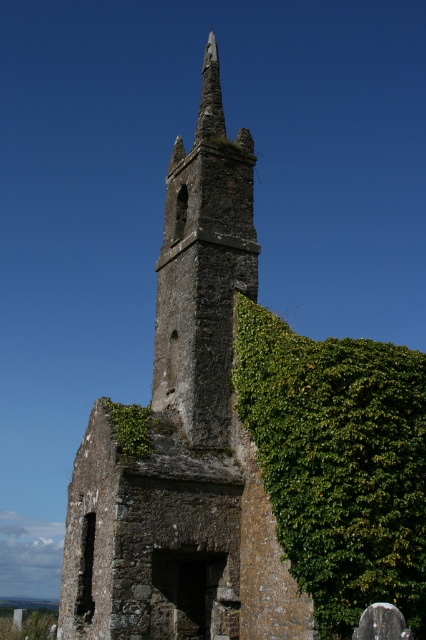
You are standing in front of the ruins of a stone church. You notice two structures at the center of the image, the rusty stone church steeple at center and the rusty stone tower at center. Which one is closer to you?

The rusty stone church steeple at center is in front of the rusty stone tower at center, so it is closer to you.

You are a photographer planning to take a picture of the rusty stone church steeple at center and the rusty stone tower at center. You want to ensure both are in frame but focus on the one that is to the right. Which object should you focus on?

The rusty stone church steeple at center is positioned on the right side of the rusty stone tower at center, so you should focus on the rusty stone church steeple at center.

You are an architect examining the ruins of an old stone church. You notice two structures at the center of the image. One is the rusty stone church steeple at center and the other is the rusty stone tower at center. Based on their positions, which one is higher in height?

The rusty stone church steeple at center is taller than the rusty stone tower at center, so the rusty stone church steeple at center is higher in height.